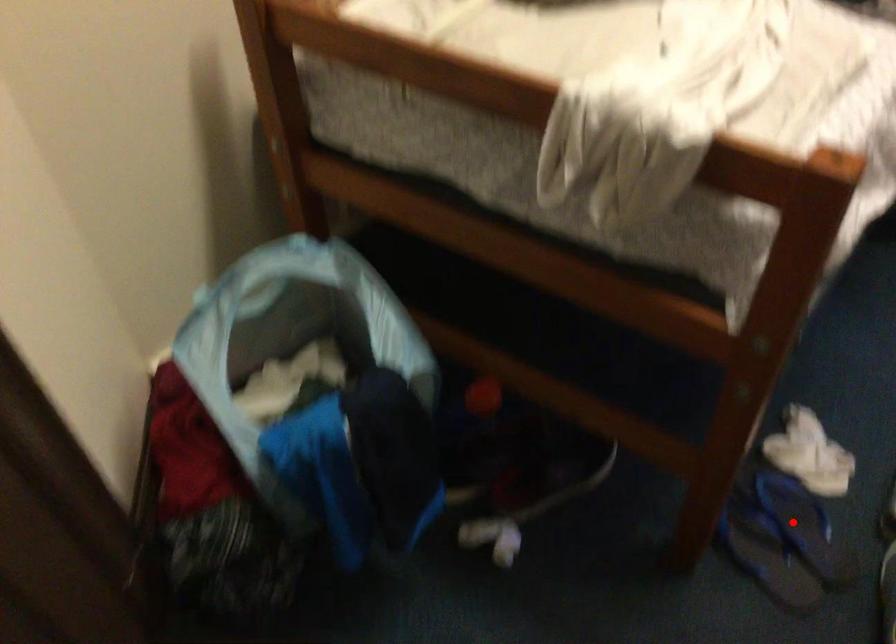
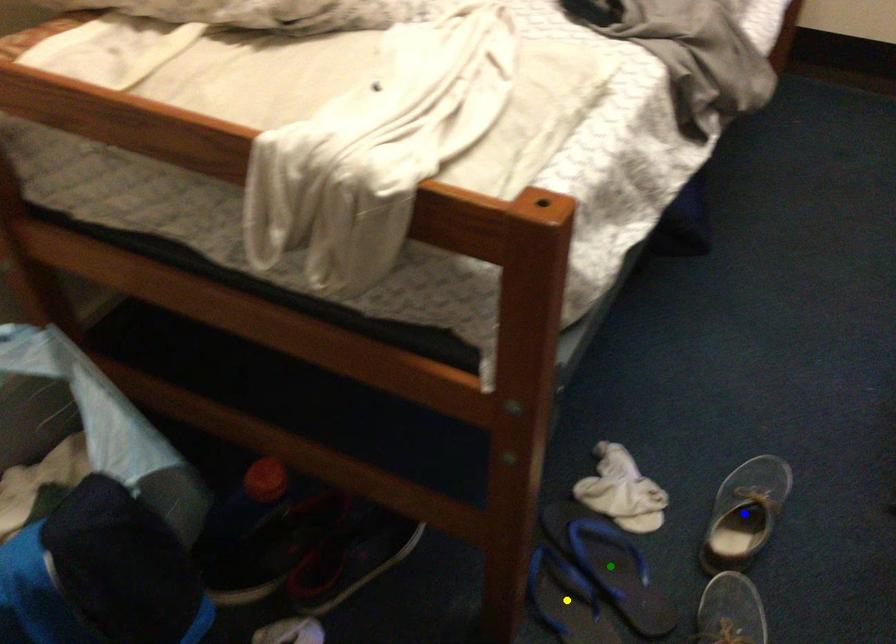
Question: I am providing you with two images of the same scene from different viewpoints. A red point is marked on the first image. You are given multiple points on the second image. Which mark in image 2 goes with the point in image 1?

Choices:
 (A) yellow point
 (B) blue point
 (C) green point

Answer: (C)